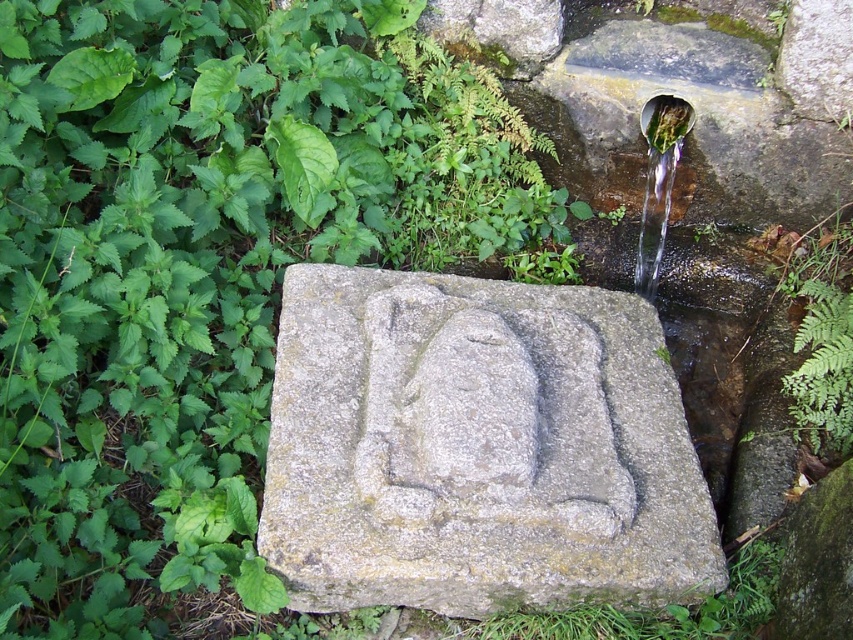
You are a maintenance worker who needs to reach both the gray stone carving at center and the green metallic pipe at upper right. The tools you carry can only be used within a 1 meter range. Can you service both objects without moving your position?

The gray stone carving at center is 84.02 centimeters away from the green metallic pipe at upper right. Since 84.02 centimeters is less than 1 meter, you can service both objects without moving your position because they are within the 1 meter range of your tools.

You are standing in the natural outdoor setting shown in the image. You want to locate the gray stone carving at center. Where should you look?

You should look at point (479, 451) to find the gray stone carving at center.